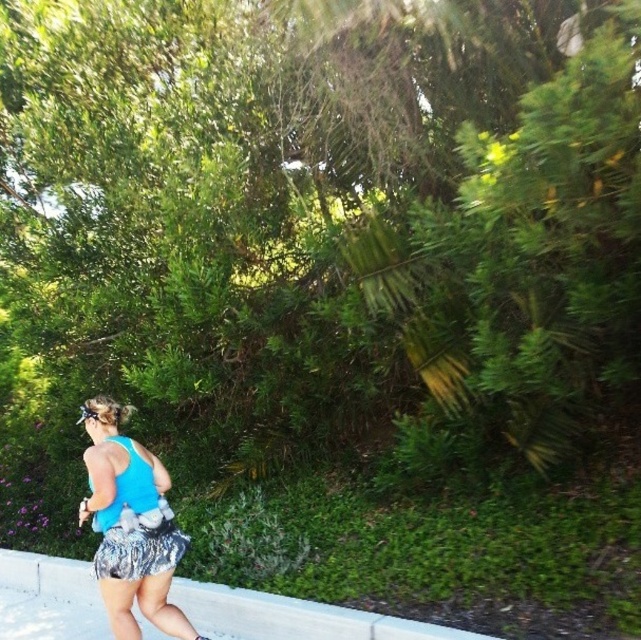
How far apart are blue fabric tank top at center and sparkly metallic shorts at lower center?

blue fabric tank top at center and sparkly metallic shorts at lower center are 4.41 inches apart.

You are a GUI agent. You are given a task and a screenshot of the screen. Output one action in this format:
    pyautogui.click(x=<x>, y=<y>)
    Task: Click on the blue fabric tank top at center
    
    Given the screenshot: What is the action you would take?
    pyautogui.click(x=129, y=525)

Is point (103, 483) closer to camera compared to point (172, 522)?

Yes, point (103, 483) is closer to viewer.

The image size is (641, 640). In order to click on blue fabric tank top at center in this screenshot , I will do `click(129, 525)`.

Is point (106, 596) closer to camera compared to point (226, 602)?

That is True.

Does blue fabric tank top at center have a greater height compared to gray concrete curb at lower center?

Yes.

Where is `blue fabric tank top at center`? The height and width of the screenshot is (640, 641). blue fabric tank top at center is located at coordinates (129, 525).

Which is behind, point (4, 564) or point (137, 570)?

Point (4, 564)

Identify the location of gray concrete curb at lower center. The width and height of the screenshot is (641, 640). (294, 616).